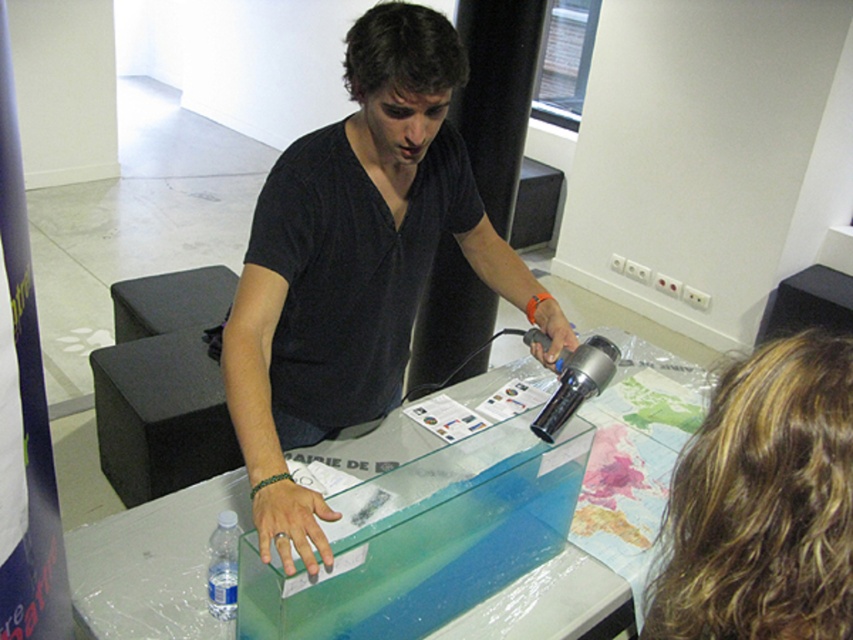
You are arranging items on a transparent glass table at center and a transparent plastic bottle at lower left. Where should you place a heavy object to avoid breaking either item?

You should place the heavy object on the transparent glass table at center since it is above the transparent plastic bottle at lower left and likely more sturdy.

Looking at this image, you are standing in front of the glass tank and notice two points marked on its surface. The first point is at coordinates point (x=416, y=538) and the second at point (x=236, y=417). Which of these points is nearer to your viewpoint?

Point (x=416, y=538) is closer to the viewer than point (x=236, y=417).